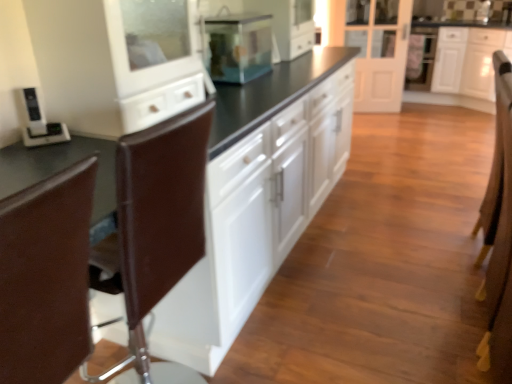
Identify the location of vacant space to the right of black plastic phone at left. tap(84, 147).